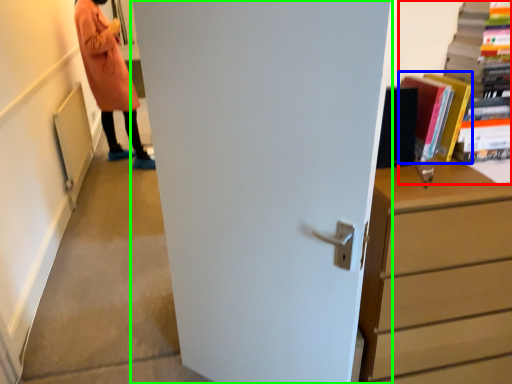
Question: Which is nearer to the book (highlighted by a red box)? book (highlighted by a blue box) or door (highlighted by a green box).

Choices:
 (A) book
 (B) door

Answer: (A)